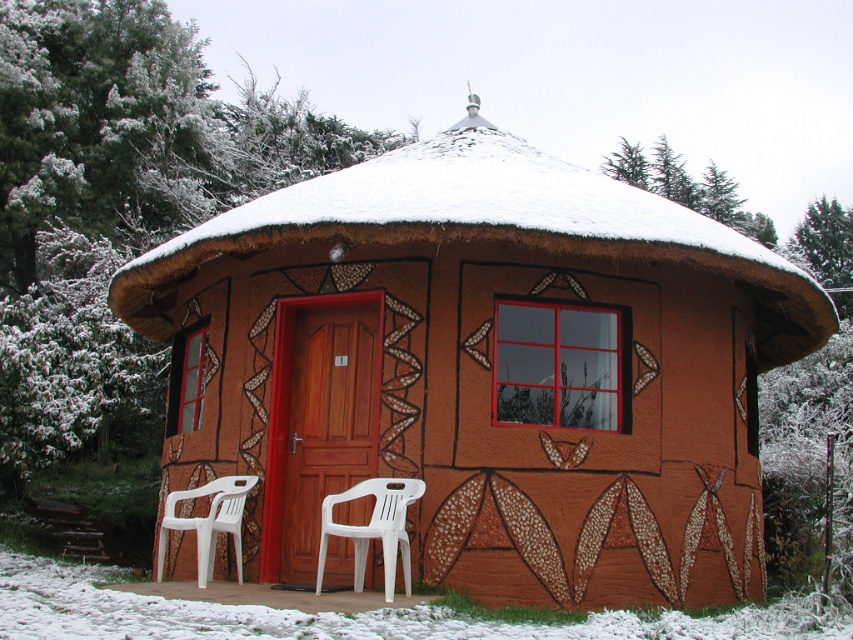
Question: Which of the following is the closest to the observer?

Choices:
 (A) (172, 499)
 (B) (321, 509)

Answer: (B)

Question: Which object appears farthest from the camera in this image?

Choices:
 (A) white plastic chair at lower left
 (B) brown textured hut at center

Answer: (B)

Question: Which point is farther to the camera?

Choices:
 (A) (386, 179)
 (B) (166, 497)
 (C) (395, 552)

Answer: (B)

Question: Is white plastic chair at front below white plastic chair at lower left?

Choices:
 (A) no
 (B) yes

Answer: (A)

Question: Can you confirm if white plastic chair at front is positioned to the left of white plastic chair at lower left?

Choices:
 (A) no
 (B) yes

Answer: (A)

Question: Can you confirm if white plastic chair at front is positioned to the left of white plastic chair at lower left?

Choices:
 (A) no
 (B) yes

Answer: (A)